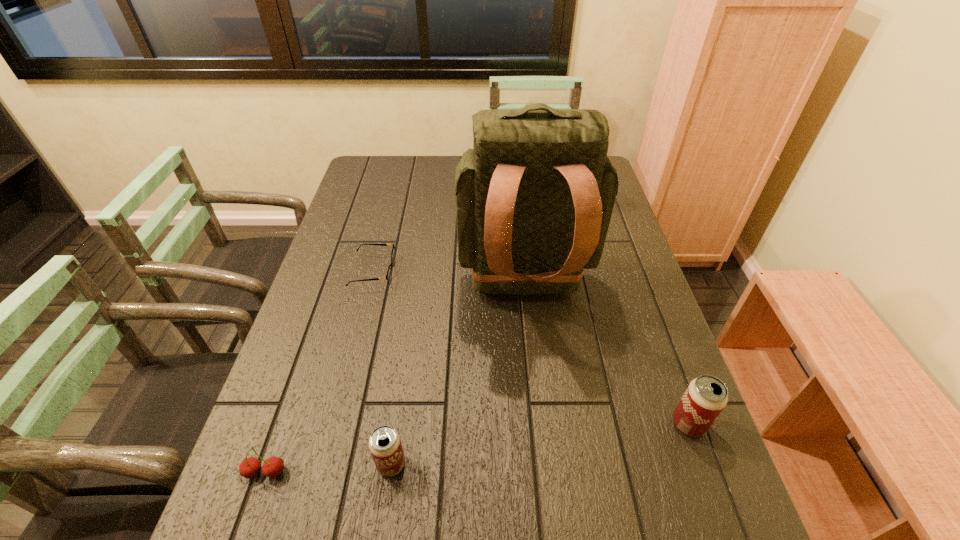
The image size is (960, 540). I want to click on the nearer beer can, so click(x=385, y=445).

The width and height of the screenshot is (960, 540). Identify the location of the third object from left to right. (385, 445).

Locate an element on the screen. This screenshot has width=960, height=540. the farther beer can is located at coordinates (705, 398).

What are the coordinates of `the second tallest object` in the screenshot? It's located at (705, 398).

Find the location of a particular element. spectacles is located at coordinates (389, 273).

Locate an element on the screen. Image resolution: width=960 pixels, height=540 pixels. the fourth object from right to left is located at coordinates (389, 273).

The height and width of the screenshot is (540, 960). Identify the location of the tallest object. (534, 197).

Find the location of a particular element. Image resolution: width=960 pixels, height=540 pixels. backpack is located at coordinates (534, 197).

The height and width of the screenshot is (540, 960). What are the coordinates of `the leftmost object` in the screenshot? It's located at (273, 466).

This screenshot has width=960, height=540. Identify the location of vacant space situated on the back of the shorter beer can. pos(409,343).